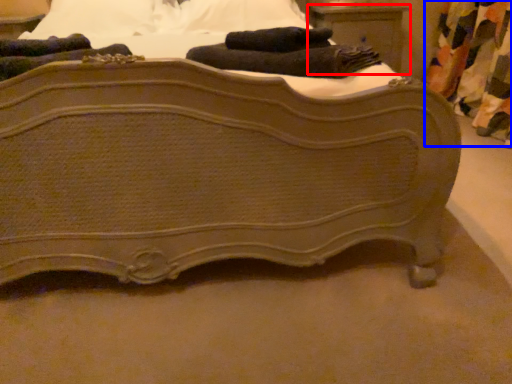
Question: Among these objects, which one is farthest to the camera, nightstand (highlighted by a red box) or curtain (highlighted by a blue box)?

Choices:
 (A) nightstand
 (B) curtain

Answer: (A)